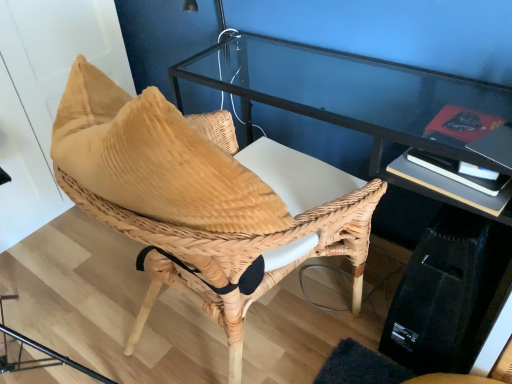
I want to click on vacant location below natural woven chair at center (from a real-world perspective), so click(x=252, y=335).